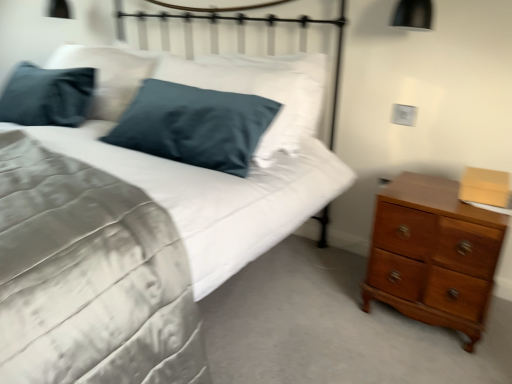
I want to click on free space that is to the left of shiny brown wooden chest of drawers at right, so click(326, 299).